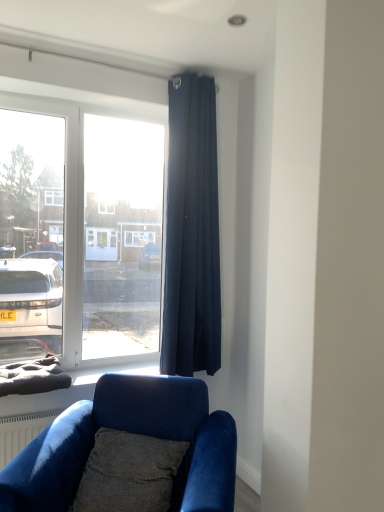
The height and width of the screenshot is (512, 384). Describe the element at coordinates (129, 473) in the screenshot. I see `textured gray pillow at lower center` at that location.

Locate an element on the screen. velvet blue couch at lower left is located at coordinates (130, 432).

What are the coordinates of `textured gray pillow at lower center` in the screenshot? It's located at (129, 473).

From the image's perspective, does textured gray pillow at lower center appear higher than dark blue fabric curtain at upper right?

Incorrect, from the image's perspective, textured gray pillow at lower center is lower than dark blue fabric curtain at upper right.

Between point (166, 462) and point (167, 213), which one is positioned in front?

The point (166, 462) is closer.

Is textured gray pillow at lower center not near dark blue fabric curtain at upper right?

That's not correct — textured gray pillow at lower center is a little close to dark blue fabric curtain at upper right.

Does textured gray pillow at lower center have a greater height compared to dark blue fabric curtain at upper right?

Incorrect, the height of textured gray pillow at lower center is not larger of that of dark blue fabric curtain at upper right.

Could you tell me if dark blue fabric curtain at upper right is turned towards textured gray pillow at lower center?

No.

Considering the relative positions of dark blue fabric curtain at upper right and textured gray pillow at lower center in the image provided, is dark blue fabric curtain at upper right to the right of textured gray pillow at lower center from the viewer's perspective?

Yes.

Who is shorter, dark blue fabric curtain at upper right or textured gray pillow at lower center?

Standing shorter between the two is textured gray pillow at lower center.

Is point (190, 84) farther from camera compared to point (75, 505)?

Yes, it is behind point (75, 505).

Choose the correct answer: Is dark blue fabric curtain at upper right inside velvet blue couch at lower left or outside it?

dark blue fabric curtain at upper right exists outside the volume of velvet blue couch at lower left.

Is dark blue fabric curtain at upper right wider or thinner than velvet blue couch at lower left?

dark blue fabric curtain at upper right is thinner than velvet blue couch at lower left.

Considering the sizes of objects dark blue fabric curtain at upper right and velvet blue couch at lower left in the image provided, who is taller, dark blue fabric curtain at upper right or velvet blue couch at lower left?

Standing taller between the two is dark blue fabric curtain at upper right.

Is dark blue fabric curtain at upper right positioned with its back to velvet blue couch at lower left?

dark blue fabric curtain at upper right does not have its back to velvet blue couch at lower left.

Considering the relative sizes of velvet blue couch at lower left and textured gray pillow at lower center in the image provided, is velvet blue couch at lower left smaller than textured gray pillow at lower center?

Actually, velvet blue couch at lower left might be larger than textured gray pillow at lower center.

Does velvet blue couch at lower left turn towards textured gray pillow at lower center?

Yes, velvet blue couch at lower left faces towards textured gray pillow at lower center.

From the image's perspective, between velvet blue couch at lower left and textured gray pillow at lower center, who is located below?

velvet blue couch at lower left, from the image's perspective.

Is velvet blue couch at lower left far away from textured gray pillow at lower center?

velvet blue couch at lower left is actually quite close to textured gray pillow at lower center.

Is velvet blue couch at lower left to the left or to the right of dark blue fabric curtain at upper right in the image?

From the image, it's evident that velvet blue couch at lower left is to the left of dark blue fabric curtain at upper right.

From the image's perspective, between velvet blue couch at lower left and dark blue fabric curtain at upper right, which one is located above?

dark blue fabric curtain at upper right is shown above in the image.

Is the depth of velvet blue couch at lower left greater than that of dark blue fabric curtain at upper right?

No, velvet blue couch at lower left is closer to the viewer.

Is velvet blue couch at lower left wider than dark blue fabric curtain at upper right?

Indeed, velvet blue couch at lower left has a greater width compared to dark blue fabric curtain at upper right.

Is textured gray pillow at lower center looking in the opposite direction of velvet blue couch at lower left?

Yes, velvet blue couch at lower left is at the back of textured gray pillow at lower center.

Which point is more distant from viewer, (125,467) or (176,490)?

The point (125,467) is farther.

You are a GUI agent. You are given a task and a screenshot of the screen. Output one action in this format:
    pyautogui.click(x=<x>, y=<y>)
    Task: Click on the pillow positioned vertically above the velvet blue couch at lower left (from a real-world perspective)
    
    Given the screenshot: What is the action you would take?
    pyautogui.click(x=129, y=473)

Locate an element on the screen. curtain above the textured gray pillow at lower center (from a real-world perspective) is located at coordinates (192, 233).

The width and height of the screenshot is (384, 512). I want to click on pillow in front of the dark blue fabric curtain at upper right, so click(129, 473).

From the image, which object appears to be farther from textured gray pillow at lower center, dark blue fabric curtain at upper right or velvet blue couch at lower left?

dark blue fabric curtain at upper right.

Based on their spatial positions, is velvet blue couch at lower left or textured gray pillow at lower center closer to dark blue fabric curtain at upper right?

velvet blue couch at lower left lies closer to dark blue fabric curtain at upper right than the other object.

From the image, which object appears to be farther from textured gray pillow at lower center, velvet blue couch at lower left or dark blue fabric curtain at upper right?

dark blue fabric curtain at upper right lies further to textured gray pillow at lower center than the other object.

Considering their positions, is dark blue fabric curtain at upper right positioned closer to velvet blue couch at lower left than textured gray pillow at lower center?

The object closer to velvet blue couch at lower left is textured gray pillow at lower center.

Based on their spatial positions, is textured gray pillow at lower center or velvet blue couch at lower left closer to dark blue fabric curtain at upper right?

velvet blue couch at lower left.

Looking at this image, based on their spatial positions, is textured gray pillow at lower center or dark blue fabric curtain at upper right closer to velvet blue couch at lower left?

Based on the image, textured gray pillow at lower center appears to be nearer to velvet blue couch at lower left.

Image resolution: width=384 pixels, height=512 pixels. In order to click on pillow between dark blue fabric curtain at upper right and velvet blue couch at lower left in the up-down direction in this screenshot , I will do `click(129, 473)`.